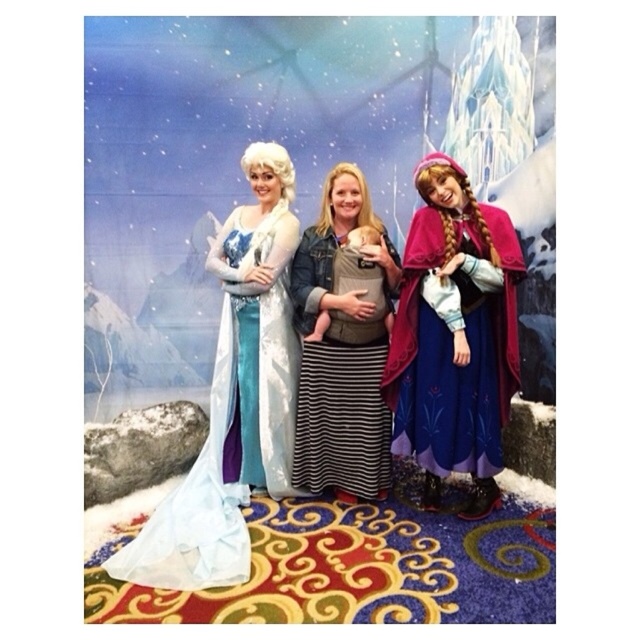
Question: Which of these objects is positioned closest to the striped denim jacket at center?

Choices:
 (A) velvet purple cape at right
 (B) satin blue gown at left

Answer: (B)

Question: Does satin blue gown at left appear under velvet purple cape at right?

Choices:
 (A) no
 (B) yes

Answer: (B)

Question: Among these points, which one is nearest to the camera?

Choices:
 (A) (244, 365)
 (B) (218, 500)
 (C) (481, 387)
 (D) (342, 209)

Answer: (C)

Question: Which point is closer to the camera taking this photo?

Choices:
 (A) (291, 328)
 (B) (381, 460)
 (C) (516, 332)

Answer: (C)

Question: Can you confirm if satin blue gown at left is smaller than velvet purple cape at right?

Choices:
 (A) no
 (B) yes

Answer: (A)

Question: Is satin blue gown at left further to the viewer compared to velvet purple cape at right?

Choices:
 (A) yes
 (B) no

Answer: (B)